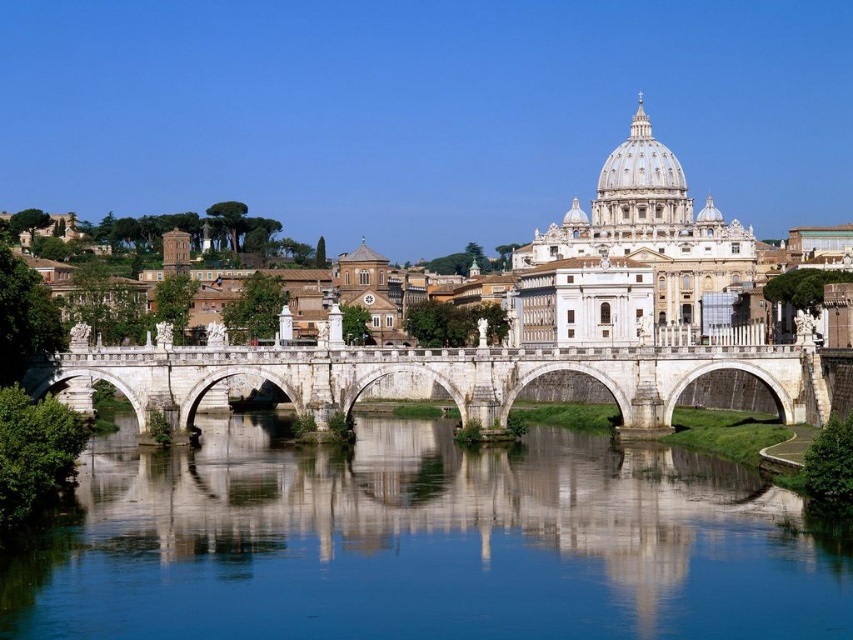
Does clear blue water at center appear on the right side of white stone bridge at center?

Yes, clear blue water at center is to the right of white stone bridge at center.

Find the location of a particular element. The image size is (853, 640). clear blue water at center is located at coordinates (424, 544).